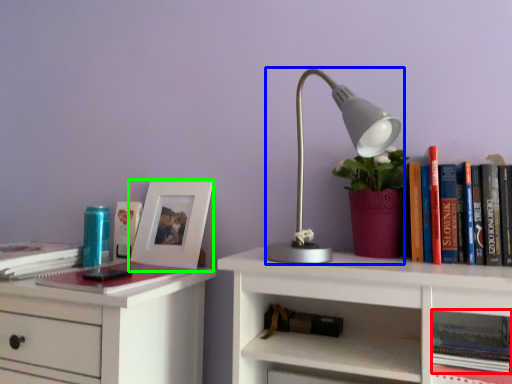
Question: Based on their relative distances, which object is nearer to book (highlighted by a red box)? Choose from lamp (highlighted by a blue box) and picture frame (highlighted by a green box).

Choices:
 (A) lamp
 (B) picture frame

Answer: (A)